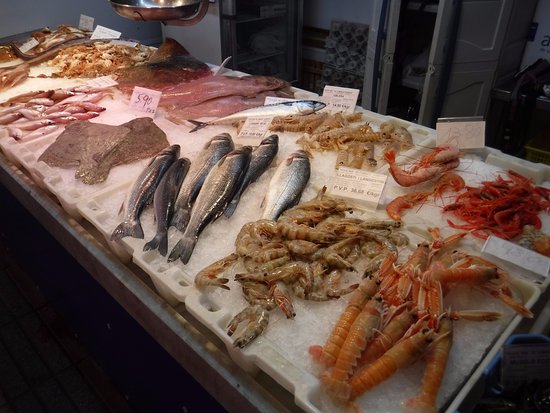
Find the location of a particular element. This screenshot has height=413, width=550. gray wall is located at coordinates (137, 28), (28, 13), (63, 5).